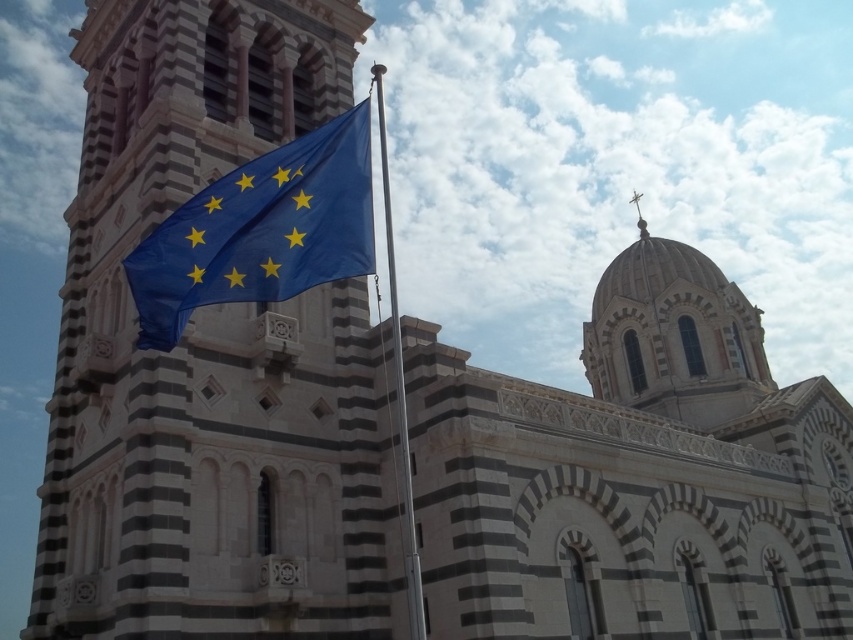
Question: Is marble tower at center below blue fabric flag at center?

Choices:
 (A) no
 (B) yes

Answer: (A)

Question: Which point is closer to the camera?

Choices:
 (A) (143, 440)
 (B) (300, 150)

Answer: (B)

Question: Where is blue fabric flag at center located in relation to blue fabric flagpole at center in the image?

Choices:
 (A) right
 (B) left

Answer: (B)

Question: Which of the following is the farthest from the observer?

Choices:
 (A) blue fabric flagpole at center
 (B) blue fabric flag at center
 (C) marble tower at center

Answer: (C)

Question: Which object is positioned closest to the blue fabric flagpole at center?

Choices:
 (A) blue fabric flag at center
 (B) marble tower at center

Answer: (A)

Question: Is marble tower at center thinner than blue fabric flagpole at center?

Choices:
 (A) no
 (B) yes

Answer: (A)